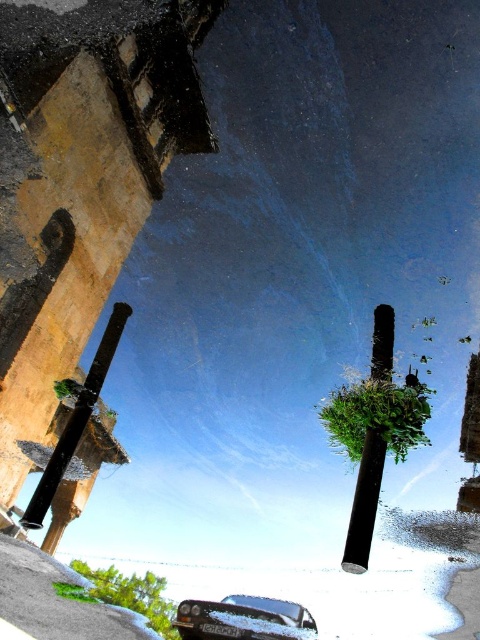
You are standing in the surreal scene and want to walk from the metallic silver car at lower center to the black matte pole at center. Which object will you encounter first?

You will encounter the metallic silver car at lower center first because it is closer to you than the black matte pole at center.

You are standing at the point labeled point (117, 332) and want to walk to the point labeled point (356, 547). Which direction should you move?

You should move forward because point (356, 547) is in front of point (117, 332).

You are a delivery driver who needs to park your metallic silver car at lower center in a parking spot that is exactly the width of the black matte pole at center. Can your car fit into the parking spot?

The metallic silver car at lower center might be wider than the black matte pole at center, so there is a possibility that the car may not fit into the parking spot designed for the pole width.